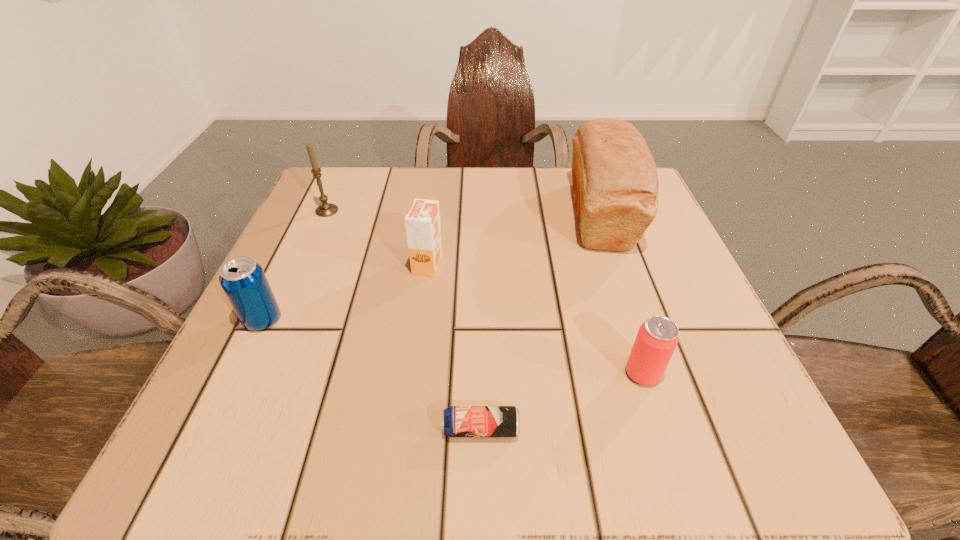
I want to click on object that is the closest to the nearest object, so click(x=657, y=338).

Identify the location of vacant area in the image that satisfies the following two spatial constraints: 1. on the back side of the fourth object from right to left; 2. on the left side of the bread. Image resolution: width=960 pixels, height=540 pixels. (434, 215).

I want to click on vacant space that satisfies the following two spatial constraints: 1. on the front side of the candle; 2. on the right side of the bread, so click(324, 215).